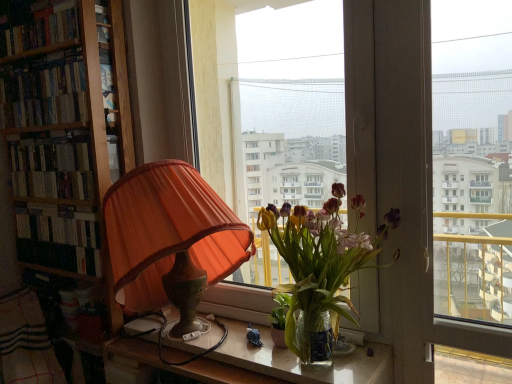
Question: Does hardcover books at left, the 1th book when ordered from bottom to top, come in front of plaid fabric at lower left?

Choices:
 (A) yes
 (B) no

Answer: (B)

Question: Is hardcover books at left, the 1th book when ordered from bottom to top, facing away from plaid fabric at lower left?

Choices:
 (A) no
 (B) yes

Answer: (A)

Question: From the image's perspective, is hardcover books at left, acting as the 3th book starting from the top, beneath plaid fabric at lower left?

Choices:
 (A) no
 (B) yes

Answer: (A)

Question: Is hardcover books at left, the 1th book when ordered from bottom to top, not within plaid fabric at lower left?

Choices:
 (A) no
 (B) yes

Answer: (B)

Question: From a real-world perspective, is hardcover books at left, acting as the 3th book starting from the top, under plaid fabric at lower left?

Choices:
 (A) yes
 (B) no

Answer: (B)

Question: From the image's perspective, is orange fabric lampshade at left positioned above or below plaid fabric at lower left?

Choices:
 (A) above
 (B) below

Answer: (A)

Question: Is orange fabric lampshade at left in front of or behind plaid fabric at lower left in the image?

Choices:
 (A) behind
 (B) front

Answer: (B)

Question: From their relative heights in the image, would you say orange fabric lampshade at left is taller or shorter than plaid fabric at lower left?

Choices:
 (A) tall
 (B) short

Answer: (A)

Question: Considering the positions of orange fabric lampshade at left and plaid fabric at lower left in the image, is orange fabric lampshade at left bigger or smaller than plaid fabric at lower left?

Choices:
 (A) big
 (B) small

Answer: (A)

Question: Considering the positions of hardcover books at left, the 1th book when ordered from bottom to top, and hardcover books at left, which ranks as the second book in top-to-bottom order, in the image, is hardcover books at left, the 1th book when ordered from bottom to top, taller or shorter than hardcover books at left, which ranks as the second book in top-to-bottom order,?

Choices:
 (A) short
 (B) tall

Answer: (B)

Question: From the image's perspective, is hardcover books at left, the 1th book when ordered from bottom to top, located above or below hardcover books at left, which ranks as the second book in top-to-bottom order?

Choices:
 (A) above
 (B) below

Answer: (B)

Question: Is point (27, 195) positioned closer to the camera than point (32, 59)?

Choices:
 (A) farther
 (B) closer

Answer: (A)

Question: From a real-world perspective, is hardcover books at left, the 1th book when ordered from bottom to top, positioned above or below hardcover books at left, which ranks as the second book in top-to-bottom order?

Choices:
 (A) below
 (B) above

Answer: (A)

Question: Considering the positions of point (64, 16) and point (18, 195), is point (64, 16) closer or farther from the camera than point (18, 195)?

Choices:
 (A) farther
 (B) closer

Answer: (B)

Question: Considering the relative positions of hardcover books at upper left, which ranks as the 3th book in bottom-to-top order, and hardcover books at left, acting as the 3th book starting from the top, in the image provided, is hardcover books at upper left, which ranks as the 3th book in bottom-to-top order, to the left or to the right of hardcover books at left, acting as the 3th book starting from the top,?

Choices:
 (A) left
 (B) right

Answer: (A)